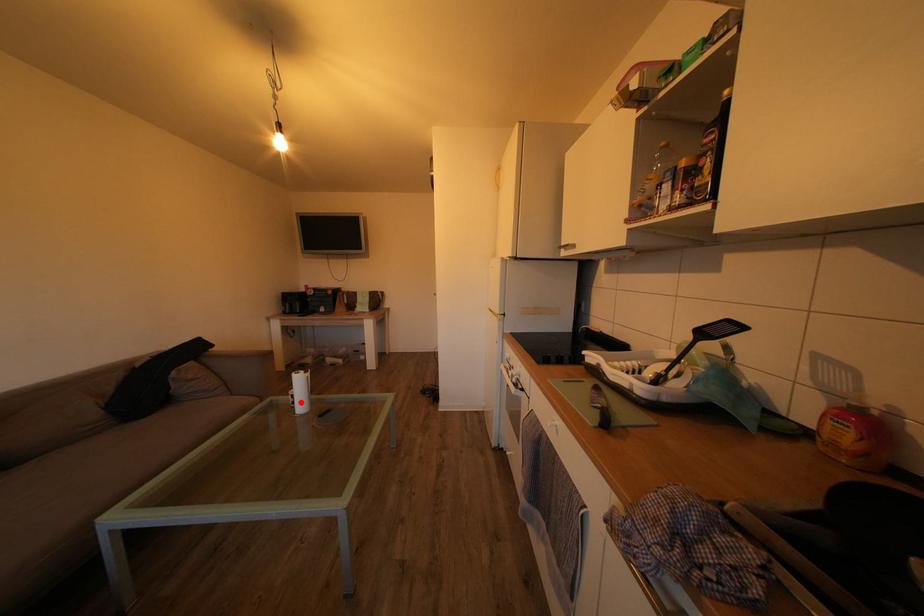
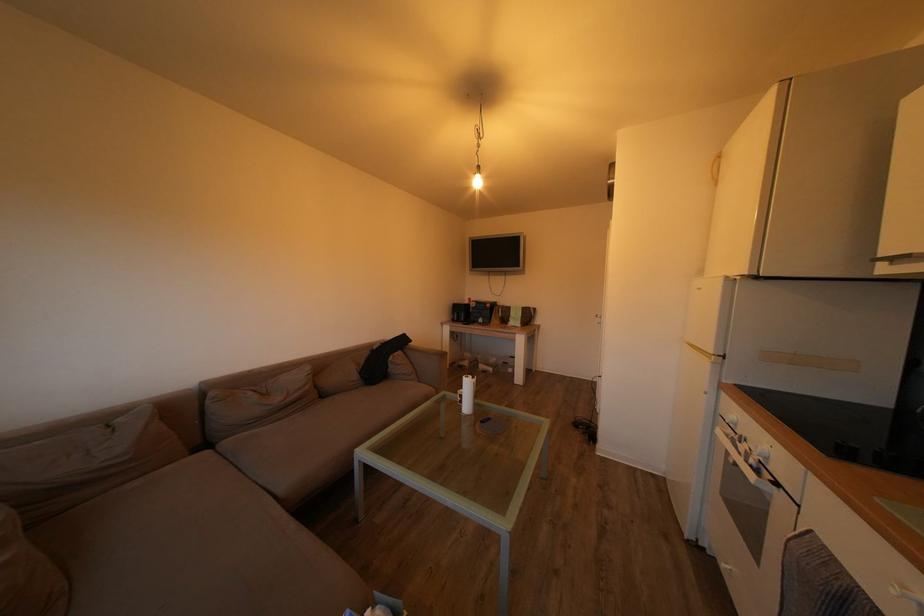
Question: A red point is marked in image1. In image2, is the corresponding 3D point closer to the camera or farther? Reply with the corresponding letter.

Choices:
 (A) The corresponding 3D point is closer.
 (B) The corresponding 3D point is farther.

Answer: (B)